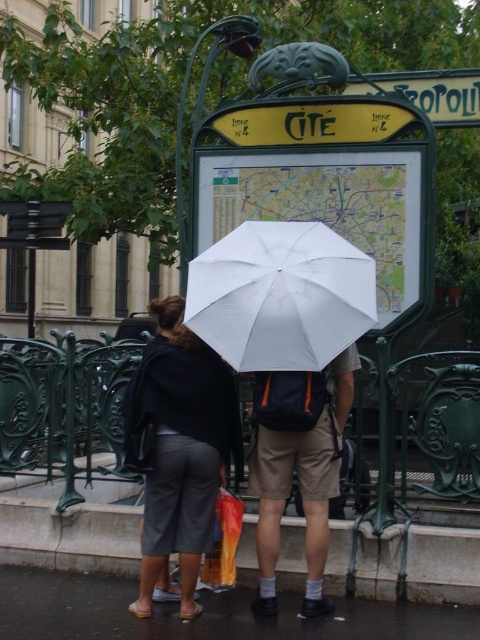
You are standing at the entrance of the Paris Metro station. You see a white matte umbrella at center and a dark gray asphalt at lower center. Which object is positioned to the right side?

The white matte umbrella at center is positioned to the right of the dark gray asphalt at lower center.

You are a delivery person standing at the metro station entrance in Paris. You need to deliver a package to the person wearing dark gray fabric pants at lower left. The package is 5 meters long. Can you hand it to them without moving from your current position?

The two individuals are 4.52 meters apart. Since the package is 5 meters long, you cannot hand it to the person wearing dark gray fabric pants at lower left without moving closer.

Based on the scene description, what is located at the coordinates point (204,612)?

The coordinates point (204,612) is occupied by dark gray asphalt at lower center.